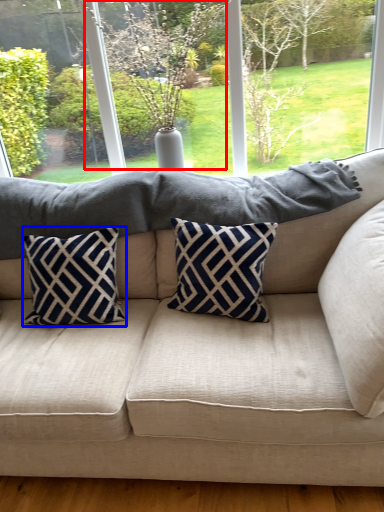
Question: Which of the following is the closest to the observer, tree (highlighted by a red box) or pillow (highlighted by a blue box)?

Choices:
 (A) tree
 (B) pillow

Answer: (B)